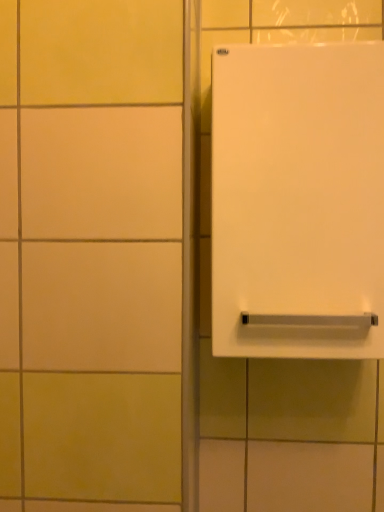
I want to click on white matte board at right, so [x=298, y=201].

In order to face white matte board at right, should I rotate leftwards or rightwards?

Turn right by 14.313 degrees to look at white matte board at right.

The width and height of the screenshot is (384, 512). What do you see at coordinates (298, 201) in the screenshot?
I see `white matte board at right` at bounding box center [298, 201].

Where is `white matte board at right`? white matte board at right is located at coordinates (298, 201).